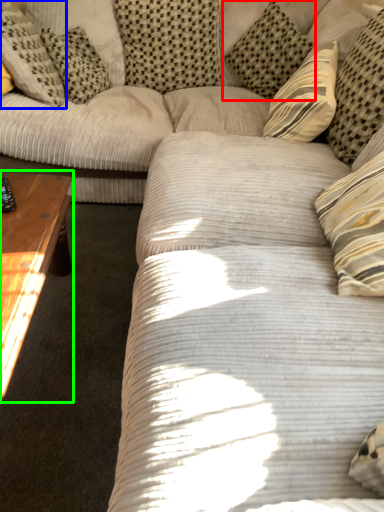
Question: Considering the real-world distances, which object is closest to pillow (highlighted by a red box)? pillow (highlighted by a blue box) or coffee table (highlighted by a green box).

Choices:
 (A) pillow
 (B) coffee table

Answer: (A)